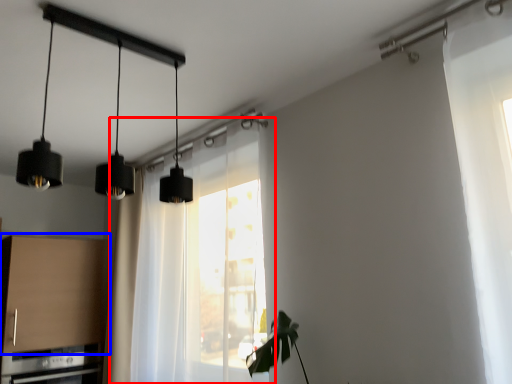
Question: Which object is closer to the camera taking this photo, window (highlighted by a red box) or cabinetry (highlighted by a blue box)?

Choices:
 (A) window
 (B) cabinetry

Answer: (A)